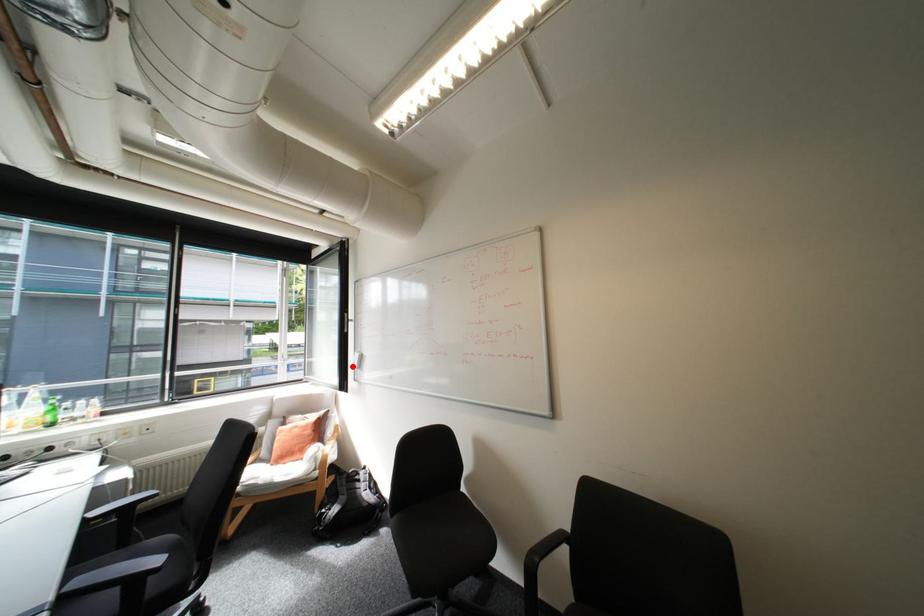
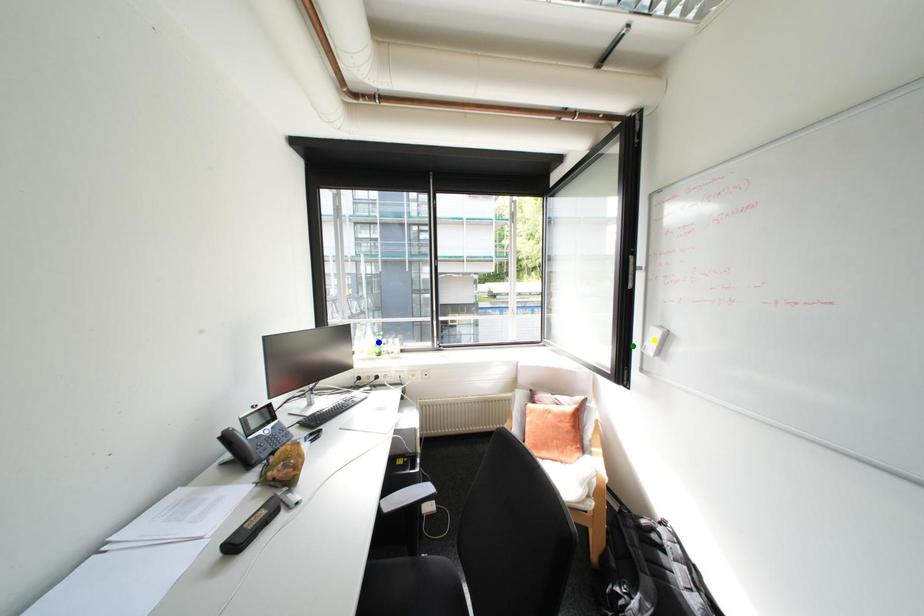
Question: I am providing you with two images of the same scene from different viewpoints. A red point is marked on the first image. You are given multiple points on the second image. Which spot in image 2 lines up with the point in image 1?

Choices:
 (A) blue point
 (B) yellow point
 (C) green point

Answer: (C)